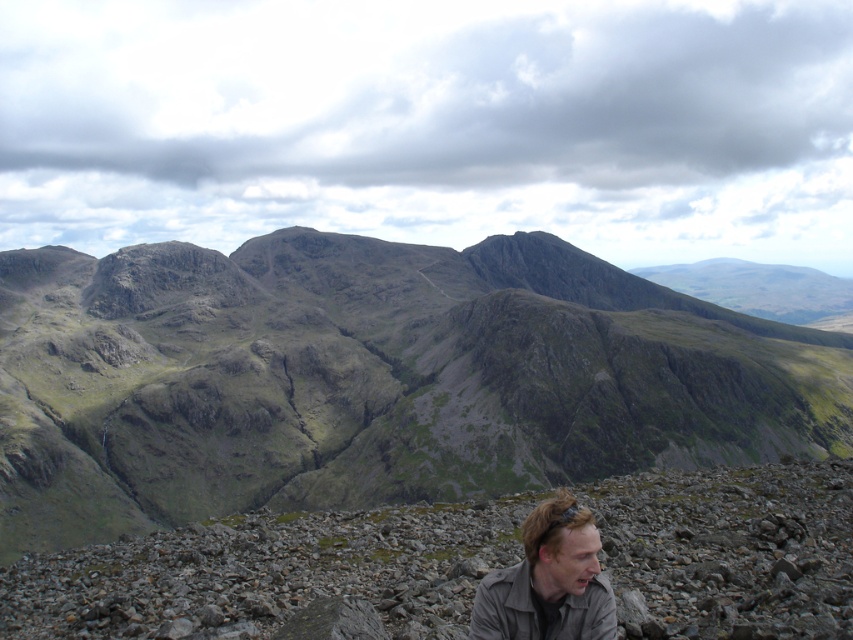
You are a hiker trying to estimate the elevation difference between the rugged stone mountain at center and the gray gravelly rocks at lower right. Which one is taller?

The rugged stone mountain at center is taller than the gray gravelly rocks at lower right.

You are a hiker standing at the base of the rugged stone mountain at center and want to reach the light brown leather jacket at lower center. Which direction should you move to get there?

The rugged stone mountain at center is to the left of the light brown leather jacket at lower center, so you should move to the right to reach the jacket.